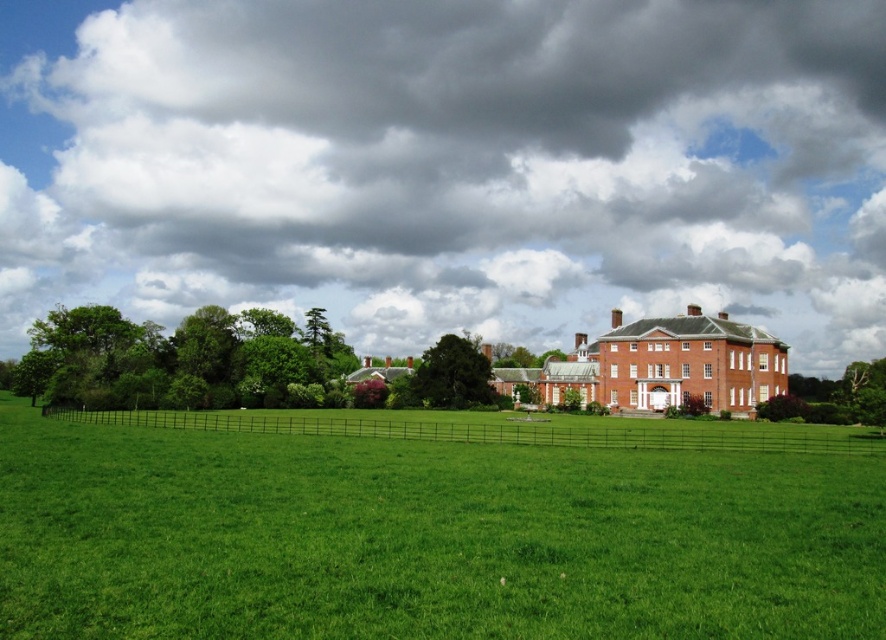
Question: Which object is closer to the camera taking this photo?

Choices:
 (A) dark gray cloud at upper center
 (B) green leafy tree at center
 (C) green grass at center

Answer: (C)

Question: Among these objects, which one is nearest to the camera?

Choices:
 (A) green leafy tree at left
 (B) green leafy tree at center
 (C) green grass at center
 (D) dark gray cloud at upper center

Answer: (C)

Question: Which of the following is the farthest from the observer?

Choices:
 (A) (491, 538)
 (B) (335, 346)
 (C) (432, 358)

Answer: (B)

Question: Can you confirm if dark gray cloud at upper center is thinner than green leafy tree at left?

Choices:
 (A) yes
 (B) no

Answer: (B)

Question: Does green grass at center come behind green leafy tree at center?

Choices:
 (A) no
 (B) yes

Answer: (A)

Question: Is green leafy tree at left positioned in front of green leafy tree at center?

Choices:
 (A) yes
 (B) no

Answer: (A)